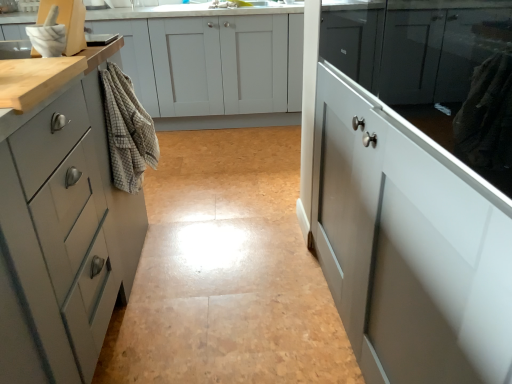
Question: Does matte gray cabinet at left, acting as the third cabinetry starting from the front, have a smaller size compared to white glossy cabinet at right, placed as the fourth cabinetry when sorted from back to front?

Choices:
 (A) yes
 (B) no

Answer: (B)

Question: Can you confirm if matte gray cabinet at left, acting as the third cabinetry starting from the front, is bigger than white glossy cabinet at right, the first cabinetry positioned from the front?

Choices:
 (A) yes
 (B) no

Answer: (A)

Question: Does matte gray cabinet at left, acting as the third cabinetry starting from the front, touch white glossy cabinet at right, placed as the fourth cabinetry when sorted from back to front?

Choices:
 (A) no
 (B) yes

Answer: (A)

Question: From a real-world perspective, is matte gray cabinet at left, acting as the second cabinetry starting from the back, located higher than white glossy cabinet at right, placed as the fourth cabinetry when sorted from back to front?

Choices:
 (A) no
 (B) yes

Answer: (A)

Question: From a real-world perspective, is matte gray cabinet at left, acting as the third cabinetry starting from the front, below white glossy cabinet at right, the first cabinetry positioned from the front?

Choices:
 (A) no
 (B) yes

Answer: (B)

Question: Does matte gray cabinet at left, acting as the second cabinetry starting from the back, have a greater height compared to white glossy cabinet at right, placed as the fourth cabinetry when sorted from back to front?

Choices:
 (A) no
 (B) yes

Answer: (B)

Question: Does matte gray cabinet at left, acting as the second cabinetry starting from the back, come behind matte white cabinet at right, which is counted as the 3th cabinetry, starting from the back?

Choices:
 (A) no
 (B) yes

Answer: (B)

Question: Is matte white cabinet at right, which is counted as the 3th cabinetry, starting from the back, inside matte gray cabinet at left, acting as the third cabinetry starting from the front?

Choices:
 (A) no
 (B) yes

Answer: (A)

Question: Is the surface of matte gray cabinet at left, acting as the second cabinetry starting from the back, in direct contact with matte white cabinet at right, marked as the 2th cabinetry in a front-to-back arrangement?

Choices:
 (A) yes
 (B) no

Answer: (B)

Question: From a real-world perspective, is matte gray cabinet at left, acting as the second cabinetry starting from the back, located higher than matte white cabinet at right, which is counted as the 3th cabinetry, starting from the back?

Choices:
 (A) no
 (B) yes

Answer: (A)

Question: Could you tell me if matte gray cabinet at left, acting as the third cabinetry starting from the front, is turned towards matte white cabinet at right, which is counted as the 3th cabinetry, starting from the back?

Choices:
 (A) no
 (B) yes

Answer: (A)

Question: Is matte gray cabinet at left, acting as the third cabinetry starting from the front, thinner than matte white cabinet at right, marked as the 2th cabinetry in a front-to-back arrangement?

Choices:
 (A) no
 (B) yes

Answer: (A)

Question: From a real-world perspective, is matte gray cabinet at left, acting as the second cabinetry starting from the back, on matte white cabinets at center, which ranks as the fourth cabinetry in front-to-back order?

Choices:
 (A) no
 (B) yes

Answer: (B)